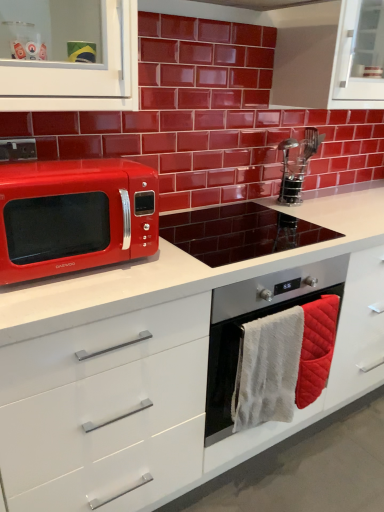
Question: Can you confirm if white glossy countertop at center is smaller than quilted cotton hand towel at lower right, the first hand towel viewed from the right?

Choices:
 (A) no
 (B) yes

Answer: (A)

Question: Considering the relative sizes of white glossy countertop at center and quilted cotton hand towel at lower right, the second hand towel positioned from the left, in the image provided, is white glossy countertop at center taller than quilted cotton hand towel at lower right, the second hand towel positioned from the left,?

Choices:
 (A) yes
 (B) no

Answer: (A)

Question: From the image's perspective, would you say white glossy countertop at center is positioned over quilted cotton hand towel at lower right, the second hand towel positioned from the left?

Choices:
 (A) no
 (B) yes

Answer: (B)

Question: Is white glossy countertop at center surrounding quilted cotton hand towel at lower right, the second hand towel positioned from the left?

Choices:
 (A) no
 (B) yes

Answer: (B)

Question: From a real-world perspective, does white glossy countertop at center sit lower than quilted cotton hand towel at lower right, the first hand towel viewed from the right?

Choices:
 (A) yes
 (B) no

Answer: (A)

Question: From a real-world perspective, is quilted cotton hand towel at lower right, the first hand towel viewed from the right, above or below glossy ceramic microwave at left?

Choices:
 (A) below
 (B) above

Answer: (A)

Question: Is quilted cotton hand towel at lower right, the second hand towel positioned from the left, wider or thinner than glossy ceramic microwave at left?

Choices:
 (A) thin
 (B) wide

Answer: (B)

Question: From the image's perspective, is quilted cotton hand towel at lower right, the first hand towel viewed from the right, above or below glossy ceramic microwave at left?

Choices:
 (A) below
 (B) above

Answer: (A)

Question: Is quilted cotton hand towel at lower right, the first hand towel viewed from the right, taller or shorter than glossy ceramic microwave at left?

Choices:
 (A) short
 (B) tall

Answer: (A)

Question: From a real-world perspective, is stainless steel oven at center physically located above or below shiny red microwave at left?

Choices:
 (A) above
 (B) below

Answer: (B)

Question: Is stainless steel oven at center bigger or smaller than shiny red microwave at left?

Choices:
 (A) big
 (B) small

Answer: (A)

Question: Does point (230, 387) appear closer or farther from the camera than point (147, 167)?

Choices:
 (A) closer
 (B) farther

Answer: (B)

Question: Considering the relative positions of stainless steel oven at center and shiny red microwave at left in the image provided, is stainless steel oven at center to the left or to the right of shiny red microwave at left?

Choices:
 (A) right
 (B) left

Answer: (A)

Question: Relative to white glossy countertop at center, is glossy ceramic microwave at left in front or behind?

Choices:
 (A) behind
 (B) front

Answer: (A)

Question: Is glossy ceramic microwave at left bigger or smaller than white glossy countertop at center?

Choices:
 (A) small
 (B) big

Answer: (A)